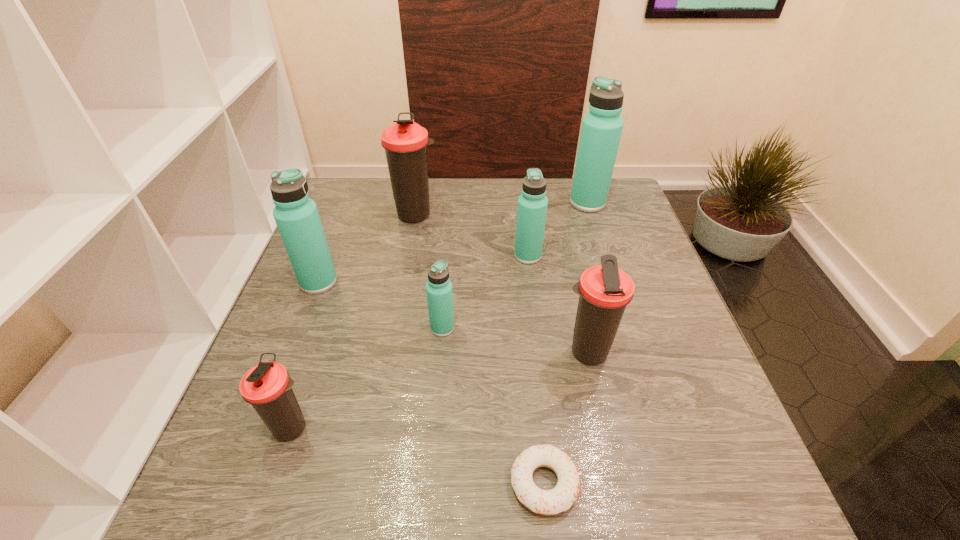
Where is `vacant area at the right edge of the desktop`? The height and width of the screenshot is (540, 960). vacant area at the right edge of the desktop is located at coordinates (632, 366).

Where is `free space at the far left corner of the desktop`? The width and height of the screenshot is (960, 540). free space at the far left corner of the desktop is located at coordinates (354, 188).

This screenshot has height=540, width=960. What are the coordinates of `vacant region at the far right corner of the desktop` in the screenshot? It's located at [617, 186].

Locate an element on the screen. This screenshot has height=540, width=960. vacant area at the near right corner is located at coordinates (764, 527).

Identify the location of free spot between the second brown thermos bottle from left to right and the doughnut. (480, 348).

I want to click on vacant space in between the seventh farthest object and the white doughnut, so click(419, 455).

The height and width of the screenshot is (540, 960). I want to click on free space between the second smallest brown thermos bottle and the fifth thermos bottle from left to right, so click(558, 304).

Where is `free spot between the second farthest aqua thermos bottle and the doughnut`? This screenshot has height=540, width=960. free spot between the second farthest aqua thermos bottle and the doughnut is located at coordinates (536, 369).

Identify the location of vacant area that lies between the seventh farthest object and the second biggest aqua thermos bottle. (305, 354).

I want to click on vacant space that's between the sixth nearest object and the biggest aqua thermos bottle, so click(x=558, y=229).